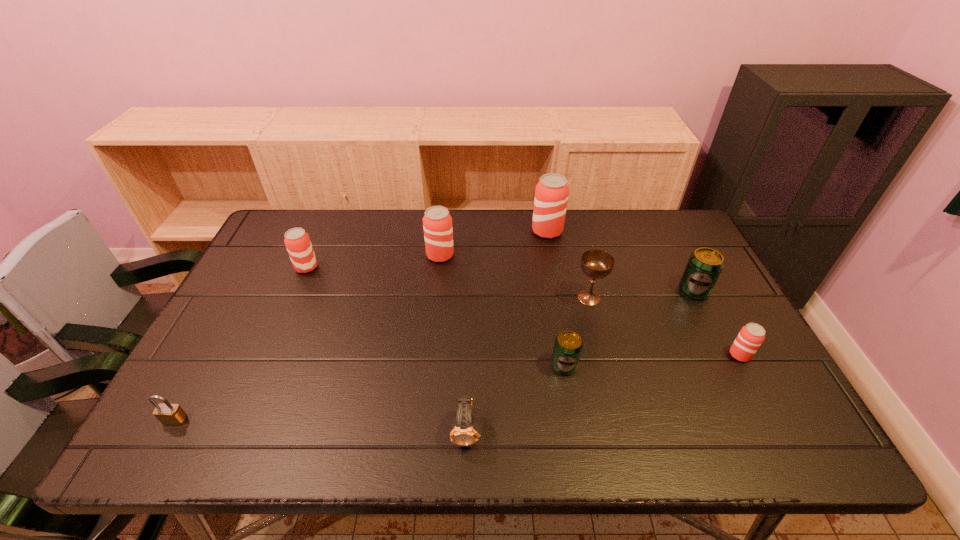
Where is `free space at the near edge of the desktop`? free space at the near edge of the desktop is located at coordinates (245, 454).

In the image, there is a desktop. Identify the location of free space at the left edge. (271, 292).

What are the coordinates of `vacant space at the far left corner of the desktop` in the screenshot? It's located at (285, 251).

This screenshot has width=960, height=540. I want to click on vacant space at the far right corner, so click(x=687, y=249).

Identify the location of vacant region between the bigger green beer can and the chalice. (641, 294).

Identify the location of vacant area that lies between the third object from left to right and the padlock. (307, 338).

The image size is (960, 540). I want to click on free space between the second tallest beer can and the bigger green beer can, so click(566, 273).

The width and height of the screenshot is (960, 540). What are the coordinates of `unoccupied position between the smallest orange beer can and the chalice` in the screenshot? It's located at (664, 326).

Identify the location of vacant area between the second smallest orange beer can and the fifth beer can from right to left. This screenshot has height=540, width=960. (373, 261).

Where is `vacant point located between the left green beer can and the nearest orange beer can`? vacant point located between the left green beer can and the nearest orange beer can is located at coordinates (652, 360).